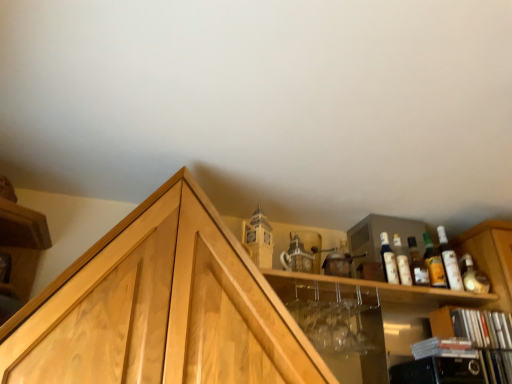
Question: From the image's perspective, does black plastic cds at lower right, which ranks as the 1th cabinetry in right-to-left order, appear lower than translucent glass bottle at upper right, positioned as the second bottle in right-to-left order?

Choices:
 (A) yes
 (B) no

Answer: (A)

Question: Is black plastic cds at lower right, which ranks as the 1th cabinetry in right-to-left order, smaller than translucent glass bottle at upper right, positioned as the second bottle in right-to-left order?

Choices:
 (A) yes
 (B) no

Answer: (B)

Question: Is black plastic cds at lower right, which ranks as the 1th cabinetry in right-to-left order, bigger than translucent glass bottle at upper right, positioned as the third bottle in left-to-right order?

Choices:
 (A) no
 (B) yes

Answer: (B)

Question: Does black plastic cds at lower right, which ranks as the 1th cabinetry in right-to-left order, have a lesser width compared to translucent glass bottle at upper right, positioned as the second bottle in right-to-left order?

Choices:
 (A) yes
 (B) no

Answer: (B)

Question: Could you tell me if black plastic cds at lower right, placed as the second cabinetry when sorted from left to right, is facing translucent glass bottle at upper right, positioned as the third bottle in left-to-right order?

Choices:
 (A) yes
 (B) no

Answer: (B)

Question: Is black plastic cds at lower right, which ranks as the 1th cabinetry in right-to-left order, located outside translucent glass bottle at upper right, positioned as the third bottle in left-to-right order?

Choices:
 (A) yes
 (B) no

Answer: (A)

Question: Is matte glass bottle at upper right, which is the fourth bottle from left to right, facing away from white glossy bottles at upper right, placed as the second bottle when sorted from left to right?

Choices:
 (A) no
 (B) yes

Answer: (A)

Question: Does matte glass bottle at upper right, which is the fourth bottle from left to right, have a lesser width compared to white glossy bottles at upper right, placed as the second bottle when sorted from left to right?

Choices:
 (A) no
 (B) yes

Answer: (A)

Question: Could you tell me if matte glass bottle at upper right, which is the fourth bottle from left to right, is facing white glossy bottles at upper right, placed as the second bottle when sorted from left to right?

Choices:
 (A) no
 (B) yes

Answer: (A)

Question: Considering the relative positions of matte glass bottle at upper right, the first bottle viewed from the right, and white glossy bottles at upper right, the third bottle in the right-to-left sequence, in the image provided, is matte glass bottle at upper right, the first bottle viewed from the right, behind white glossy bottles at upper right, the third bottle in the right-to-left sequence,?

Choices:
 (A) yes
 (B) no

Answer: (A)

Question: Considering the relative sizes of matte glass bottle at upper right, the first bottle viewed from the right, and white glossy bottles at upper right, the third bottle in the right-to-left sequence, in the image provided, is matte glass bottle at upper right, the first bottle viewed from the right, taller than white glossy bottles at upper right, the third bottle in the right-to-left sequence,?

Choices:
 (A) no
 (B) yes

Answer: (B)

Question: Does matte glass bottle at upper right, which is the fourth bottle from left to right, appear on the right side of white glossy bottles at upper right, placed as the second bottle when sorted from left to right?

Choices:
 (A) no
 (B) yes

Answer: (B)

Question: Is translucent glass bottle at upper right, positioned as the third bottle in left-to-right order, shorter than matte glass bottle at upper right, the first bottle viewed from the right?

Choices:
 (A) no
 (B) yes

Answer: (B)